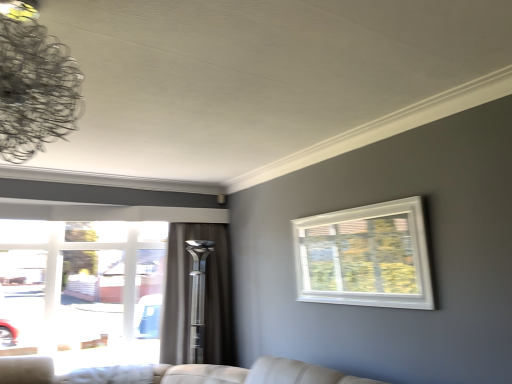
Question: In the image, is silky gray curtain at center positioned in front of or behind metallic wire chandelier at upper left?

Choices:
 (A) front
 (B) behind

Answer: (B)

Question: From the image's perspective, relative to metallic wire chandelier at upper left, is silky gray curtain at center above or below?

Choices:
 (A) above
 (B) below

Answer: (B)

Question: Based on their relative distances, which object is nearer to the white plastic window at upper right, the 1th window viewed from the right?

Choices:
 (A) silky gray curtain at center
 (B) metallic wire chandelier at upper left
 (C) clear glass window at left, the first window when ordered from left to right

Answer: (A)

Question: Which of these objects is positioned closest to the clear glass window at left, which appears as the 1th window when viewed from the back?

Choices:
 (A) white plastic window at upper right, positioned as the second window in left-to-right order
 (B) metallic wire chandelier at upper left
 (C) silky gray curtain at center

Answer: (C)